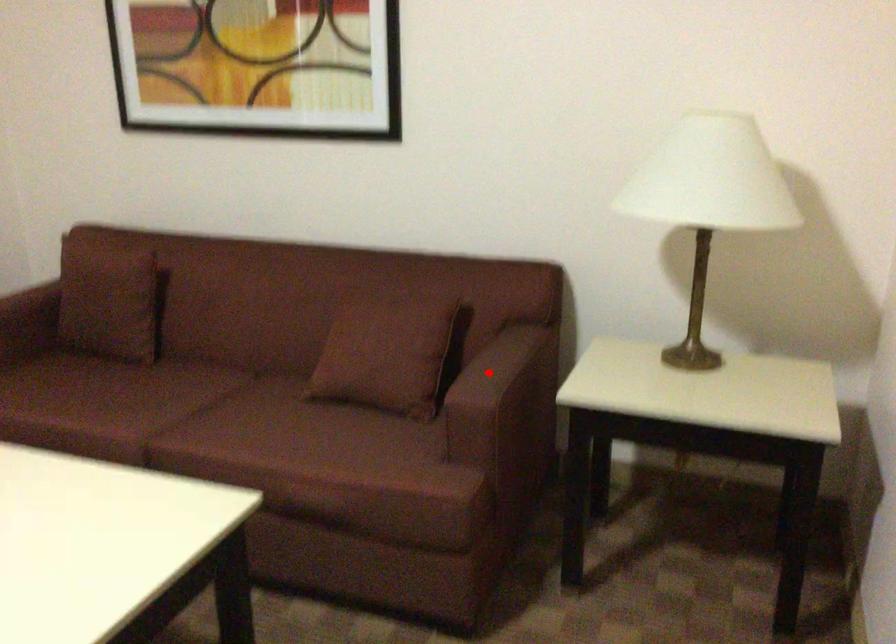
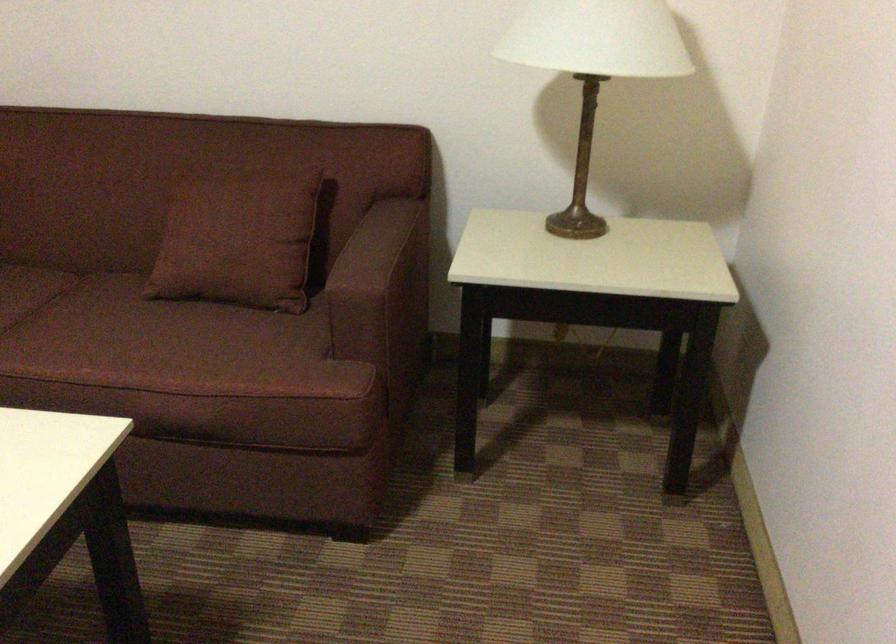
Question: I am providing you with two images of the same scene from different viewpoints. Image1 has a red point marked. In image2, the corresponding 3D location appears at what relative position? Reply with the corresponding letter.

Choices:
 (A) Closer
 (B) Farther

Answer: (A)